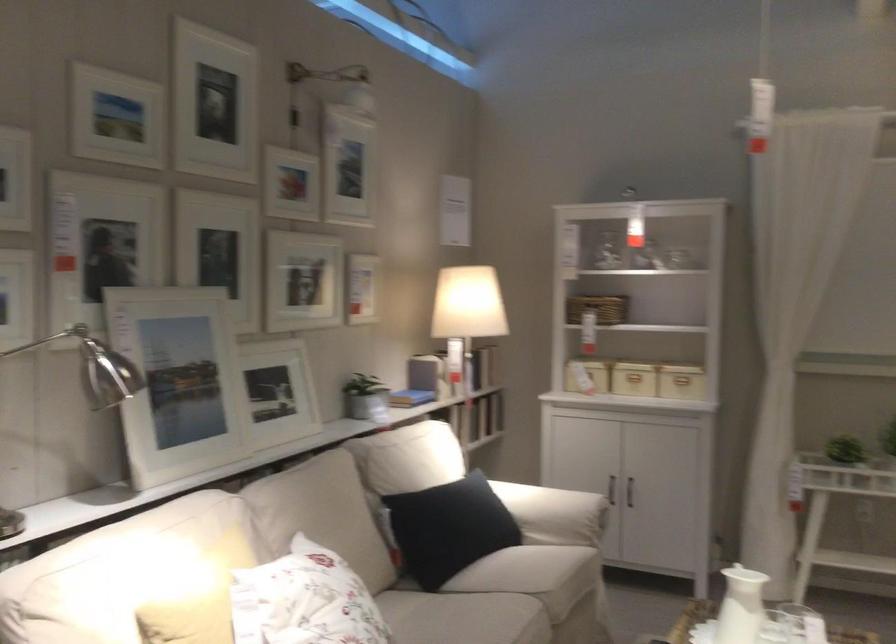
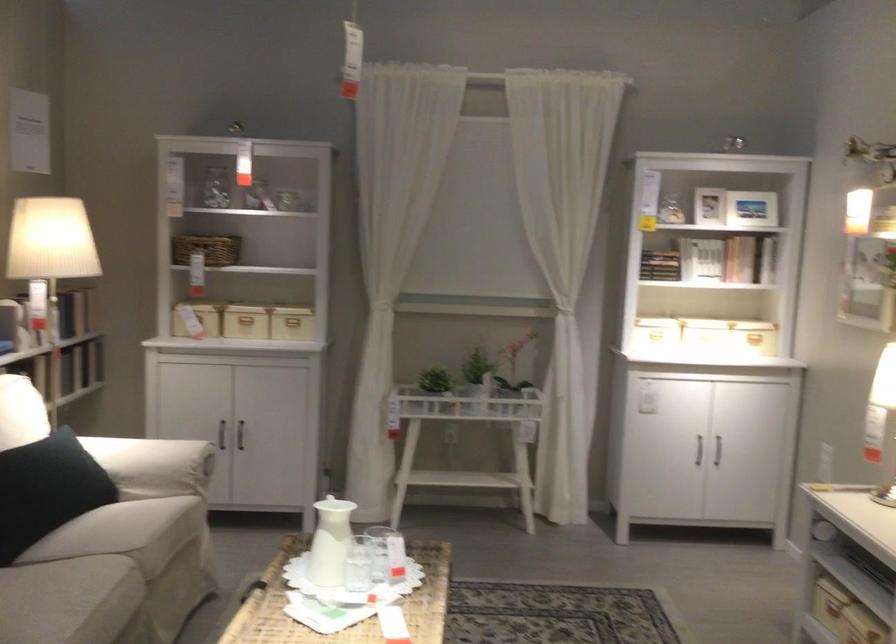
Find the pixel in the second image that matches (616,484) in the first image.

(221, 433)